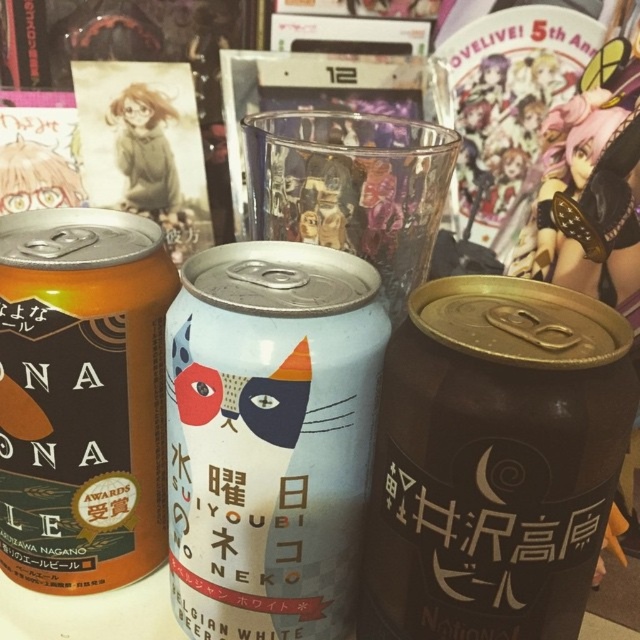
Question: Which of the following is the closest to the observer?

Choices:
 (A) black matte can at center
 (B) matte orange can at left
 (C) matte blue can at center

Answer: (A)

Question: Considering the real-world distances, which object is closest to the black matte can at center?

Choices:
 (A) matte orange can at left
 (B) matte blue can at center

Answer: (B)

Question: Can you confirm if matte blue can at center is positioned to the right of matte orange can at left?

Choices:
 (A) no
 (B) yes

Answer: (B)

Question: Is black matte can at center bigger than matte orange can at left?

Choices:
 (A) no
 (B) yes

Answer: (A)

Question: Among these objects, which one is farthest from the camera?

Choices:
 (A) matte orange can at left
 (B) black matte can at center

Answer: (A)

Question: Is black matte can at center to the left of matte orange can at left from the viewer's perspective?

Choices:
 (A) yes
 (B) no

Answer: (B)